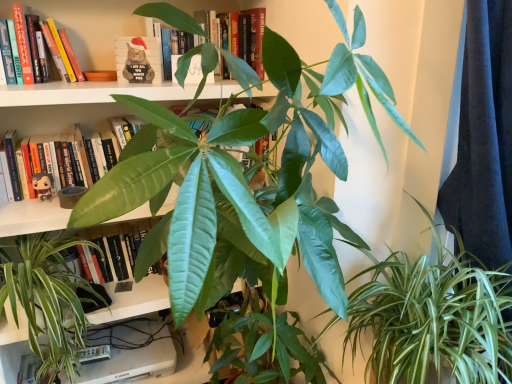
Question: From a real-world perspective, is hardcover book at upper center, which appears as the third book when ordered from the bottom, above or below matte black figurine at left?

Choices:
 (A) above
 (B) below

Answer: (A)

Question: Based on their sizes in the image, would you say hardcover book at upper center, marked as the 1th book in a top-to-bottom arrangement, is bigger or smaller than matte black figurine at left?

Choices:
 (A) big
 (B) small

Answer: (A)

Question: Based on their relative distances, which object is farther from the green glossy leafy plant at lower right, arranged as the 3th houseplant when viewed from the left?

Choices:
 (A) matte black figurine at left
 (B) santa hat plush at upper center
 (C) hardcover book at upper left, marked as the 2th book in a bottom-to-top arrangement
 (D) green glossy leafy plant at center, the second houseplant in the left-to-right sequence
 (E) green matte leaf at upper center

Answer: (C)

Question: Which object is positioned closest to the green matte leaf at upper center?

Choices:
 (A) matte black figurine at left, the third book when ordered from top to bottom
 (B) green glossy leafy plant at lower right, arranged as the 3th houseplant when viewed from the left
 (C) green glossy leafy plant at center, the third houseplant from the right
 (D) matte black figurine at left
 (E) santa hat plush at upper center

Answer: (E)